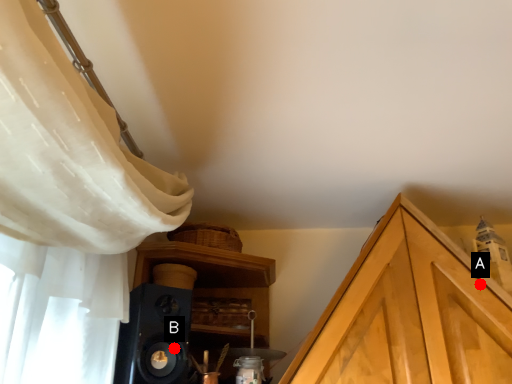
Question: Two points are circled on the image, labeled by A and B beside each circle. Which point is farther from the camera taking this photo?

Choices:
 (A) A is further
 (B) B is further

Answer: (A)